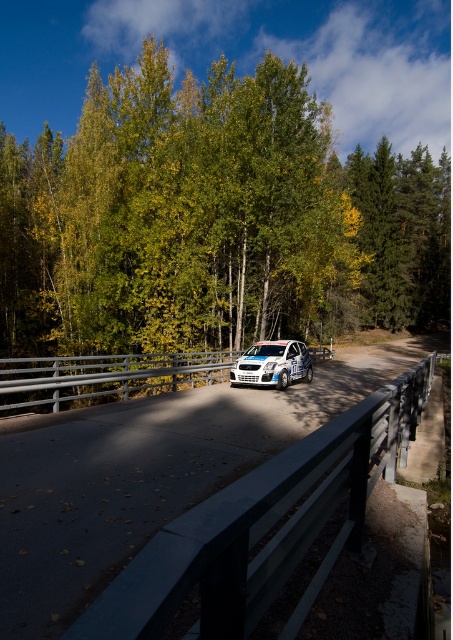
Who is shorter, white glossy car at center or white glossy rally car at center?

Standing shorter between the two is white glossy car at center.

In the scene shown: Does white glossy car at center come behind white glossy rally car at center?

No, white glossy car at center is in front of white glossy rally car at center.

Which is behind, point (38, 529) or point (308, 355)?

Positioned behind is point (308, 355).

Where is `white glossy car at center`? This screenshot has height=640, width=453. white glossy car at center is located at coordinates (145, 474).

Is green leafy tree at center to the right of white glossy rally car at center from the viewer's perspective?

Correct, you'll find green leafy tree at center to the right of white glossy rally car at center.

The height and width of the screenshot is (640, 453). What are the coordinates of `green leafy tree at center` in the screenshot? It's located at (212, 220).

Which is above, green leafy tree at center or white glossy car at center?

green leafy tree at center is higher up.

Between green leafy tree at center and white glossy car at center, which one appears on the right side from the viewer's perspective?

Positioned to the right is green leafy tree at center.

Which is behind, point (102, 124) or point (123, 467)?

The point (102, 124) is more distant.

The image size is (453, 640). I want to click on green leafy tree at center, so click(x=212, y=220).